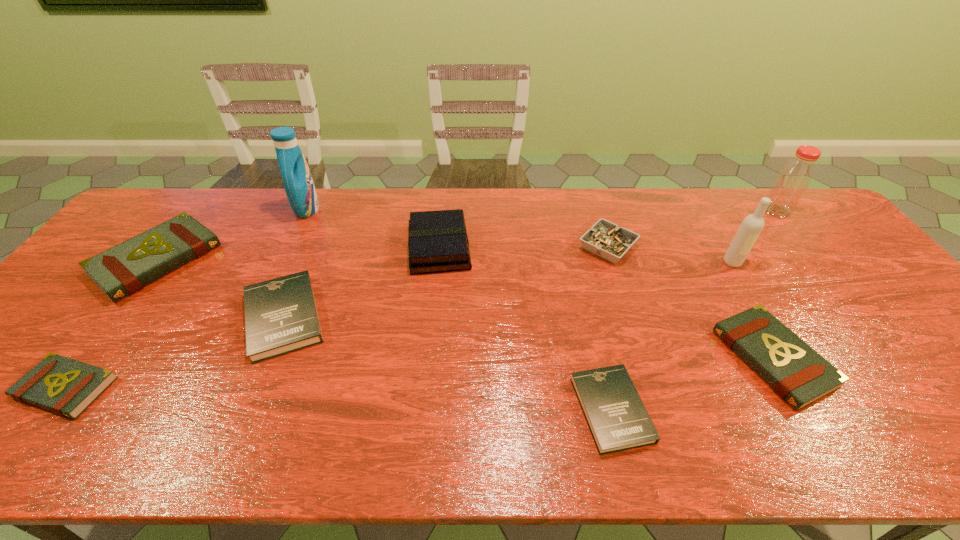
At what (x,y) coordinates should I click in order to perform the action: click on free spot located on the back of the gray ashtray. Please return your answer as a coordinate pair (x, y). This screenshot has width=960, height=540. Looking at the image, I should click on (593, 200).

Where is `blank space located 0.240m on the back of the rightmost book`? This screenshot has width=960, height=540. blank space located 0.240m on the back of the rightmost book is located at coordinates (713, 252).

Where is `free point located on the right of the farther dark book`? Image resolution: width=960 pixels, height=540 pixels. free point located on the right of the farther dark book is located at coordinates (460, 318).

The height and width of the screenshot is (540, 960). What are the coordinates of `free space located 0.350m on the left of the second book from right to left` in the screenshot? It's located at (414, 409).

At what (x,y) coordinates should I click in order to perform the action: click on detergent situated at the far edge. Please return your answer as a coordinate pair (x, y). The height and width of the screenshot is (540, 960). Looking at the image, I should click on (297, 179).

This screenshot has width=960, height=540. In order to click on bottle present at the far edge in this screenshot , I will do `click(792, 181)`.

This screenshot has height=540, width=960. What are the coordinates of `ashtray located in the far edge section of the desktop` in the screenshot? It's located at (605, 239).

Find the location of a particular element. This screenshot has height=540, width=960. object located in the near edge section of the desktop is located at coordinates (617, 418).

Identify the location of object at the left edge. Image resolution: width=960 pixels, height=540 pixels. (124, 269).

What are the coordinates of `object located at the right edge` in the screenshot? It's located at (792, 181).